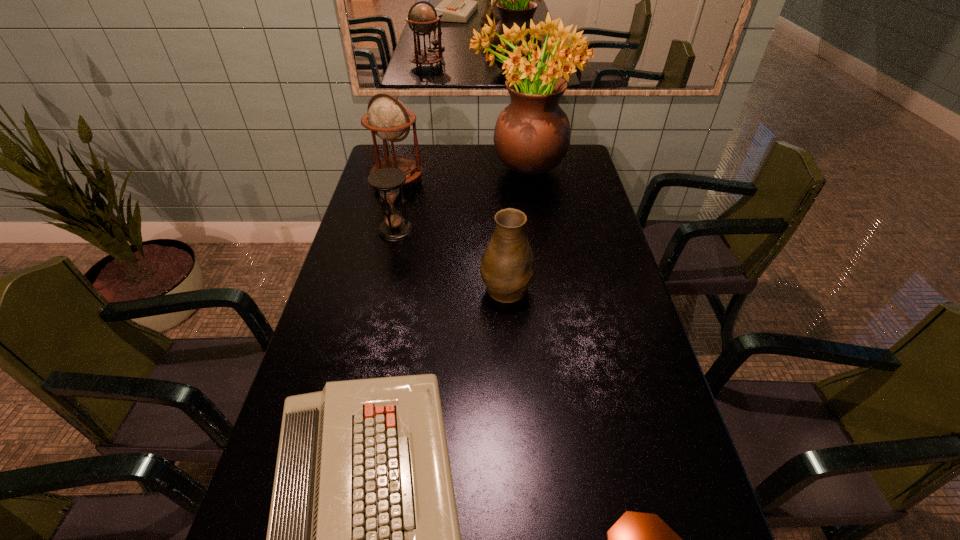
At what (x,y) coordinates should I click in order to perform the action: click on vacant space located on the handle side of the third nearest object. Please return your answer as a coordinate pair (x, y). Looking at the image, I should click on (504, 251).

Where is `free space located on the back of the fourth nearest object`? This screenshot has width=960, height=540. free space located on the back of the fourth nearest object is located at coordinates (407, 179).

Find the location of a particular element. Image resolution: width=960 pixels, height=540 pixels. flower arrangement that is at the far edge is located at coordinates (532, 134).

Locate an element on the screen. This screenshot has width=960, height=540. globe at the far edge is located at coordinates (388, 118).

Locate an element on the screen. The image size is (960, 540). globe at the left edge is located at coordinates (388, 118).

Locate an element on the screen. The image size is (960, 540). hourglass that is at the left edge is located at coordinates (387, 180).

In order to click on object located in the right edge section of the desktop in this screenshot , I will do `click(532, 134)`.

You are a GUI agent. You are given a task and a screenshot of the screen. Output one action in this format:
    pyautogui.click(x=<x>, y=<y>)
    Task: Click on the object at the far left corner
    Image resolution: width=960 pixels, height=540 pixels.
    Given the screenshot: What is the action you would take?
    pyautogui.click(x=388, y=118)

The height and width of the screenshot is (540, 960). Identify the location of object that is at the far right corner. (532, 134).

This screenshot has height=540, width=960. I want to click on free space at the far edge, so click(455, 161).